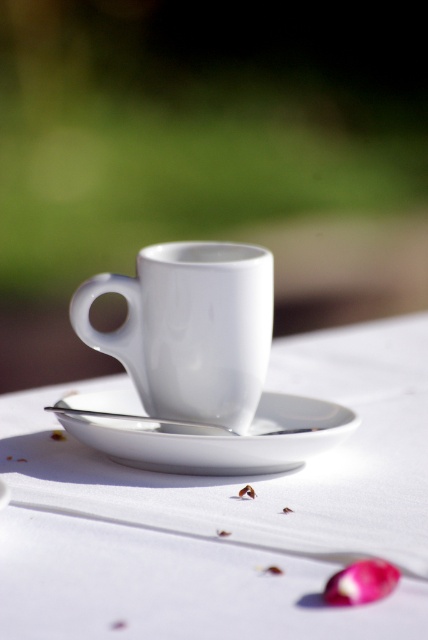
Does white glossy saucer at center appear under silver metallic spoon at center?

Yes, white glossy saucer at center is below silver metallic spoon at center.

Does point (320, 449) come in front of point (50, 406)?

That is True.

Image resolution: width=428 pixels, height=640 pixels. In order to click on white glossy saucer at center in this screenshot , I will do `click(205, 433)`.

Is point (416, 472) more distant than point (74, 426)?

Yes, point (416, 472) is farther from viewer.

Measure the distance between white ceramic cup at center and camera.

white ceramic cup at center is 11.46 inches away from camera.

Identify the location of white ceramic cup at center. (225, 515).

Is white ceramic cup at center shorter than silver metallic spoon at center?

No.

How distant is white ceramic cup at center from silver metallic spoon at center?

They are 6.01 inches apart.

Find the location of `white ceramic cup at center`. white ceramic cup at center is located at coordinates click(225, 515).

You are a GUI agent. You are given a task and a screenshot of the screen. Output one action in this format:
    pyautogui.click(x=<x>, y=<y>)
    Task: Click on the white ceramic cup at center
    
    Given the screenshot: What is the action you would take?
    pyautogui.click(x=225, y=515)